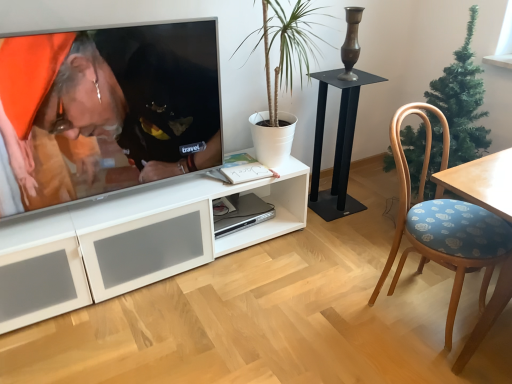
The height and width of the screenshot is (384, 512). I want to click on vacant region below wooden chair with blue floral cushion at right (from a real-world perspective), so click(x=420, y=307).